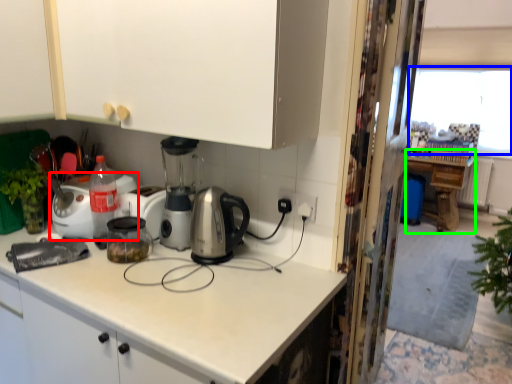
Question: Which object is positioned farthest from home appliance (highlighted by a red box)? Select from window screen (highlighted by a blue box) and table (highlighted by a green box).

Choices:
 (A) window screen
 (B) table

Answer: (A)